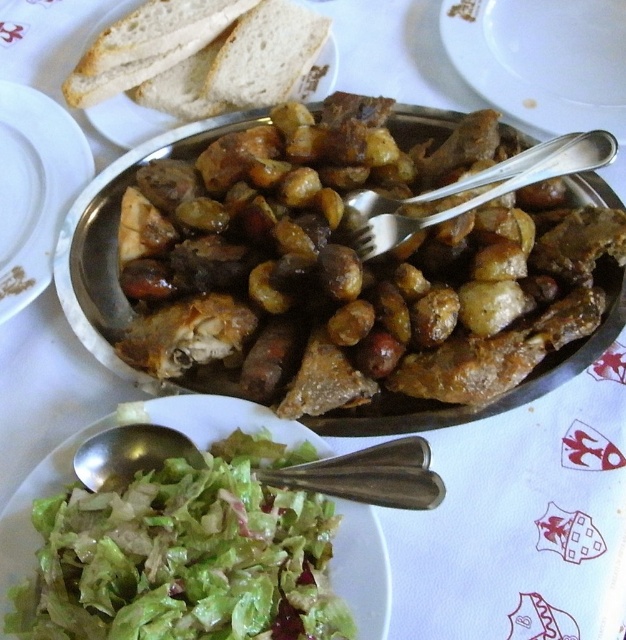
You are a chef preparing to serve a meal. You have a brown matte platter at center and a satin silver fork at upper center on the table. Which item would you need to move first if you want to place a new dish between them?

The satin silver fork at upper center would need to be moved first because the brown matte platter at center is larger and cannot be easily shifted to accommodate the new dish.

You are a diner sitting at the table. You want to reach for the satin silver fork at upper center to eat the stew in the brown matte platter at center. Can you grab the fork without moving your hand past the platter?

The brown matte platter at center is above the satin silver fork at upper center, so the platter is blocking the path to the fork. You would need to move your hand around or under the platter to reach the fork.

You are a waiter carrying a tray and need to place a new dish between the white soft bread at upper left and the brown matte platter at center. The dish is 10 inches wide. Can you fit it between them?

The white soft bread at upper left and brown matte platter at center are 9.78 inches apart from each other. Since the dish is 10 inches wide, it cannot fit between them as the space is slightly narrower than the dish.